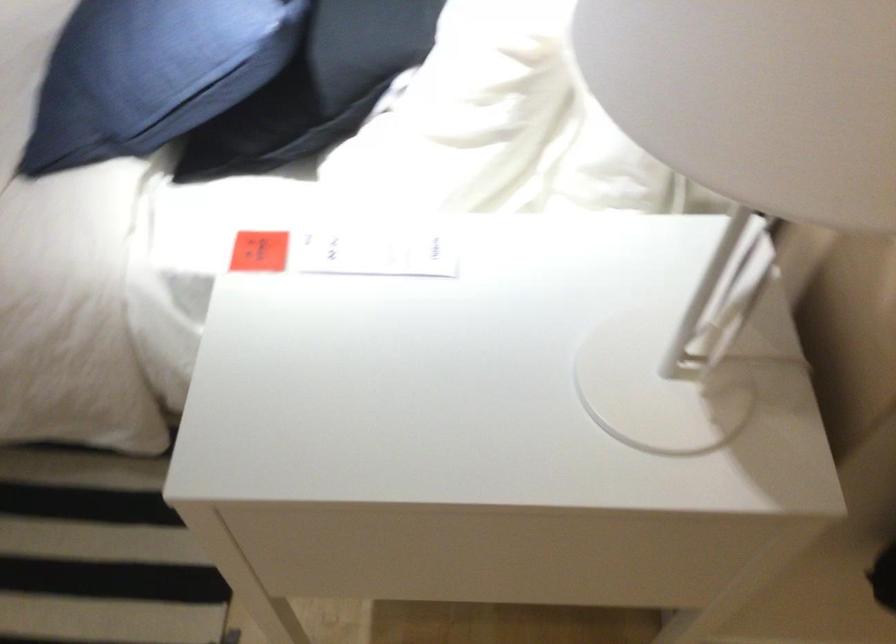
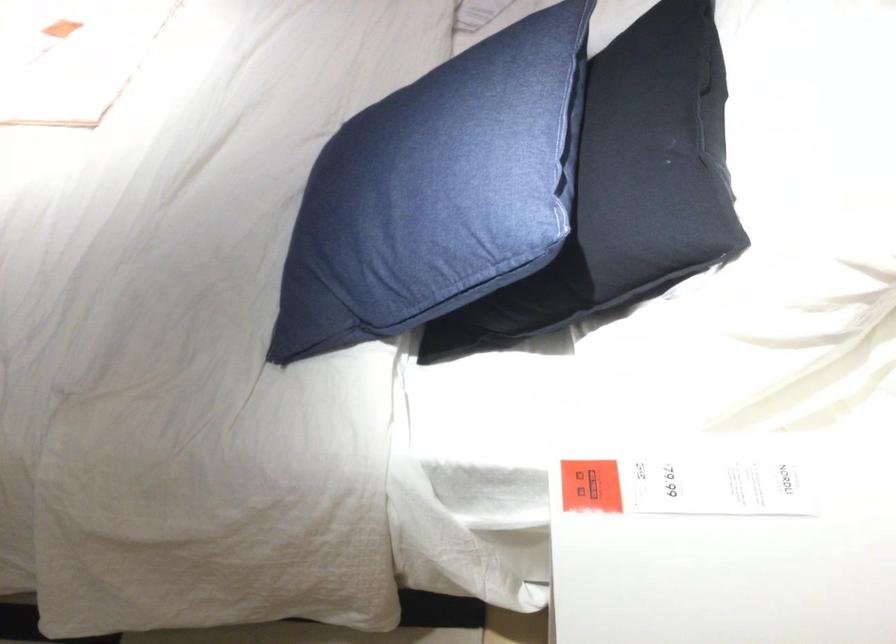
Question: In a continuous first-person perspective shot, in which direction is the camera moving?

Choices:
 (A) Left
 (B) Right
 (C) Forward
 (D) Backward

Answer: (A)